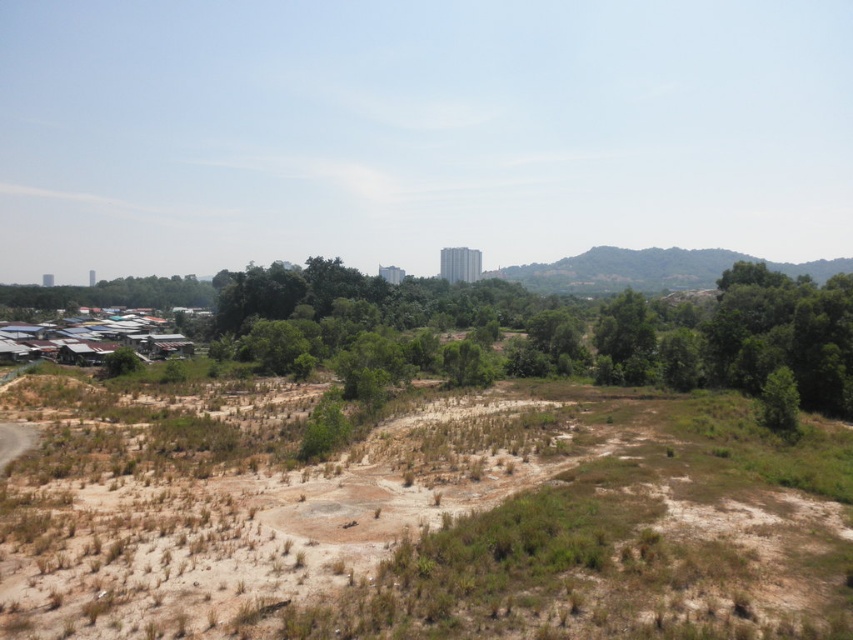
You are standing at the center of the open area in the image and want to walk towards the residential buildings in the distance. There are two points marked in the image, point A at coordinates point A is point (773,324) and point B at point (723,268). Which point should you walk towards to reach the buildings faster?

Point A at coordinates point A is point (773,324) is in front of point B at point (723,268), so walking towards point A would be closer to the buildings and faster.